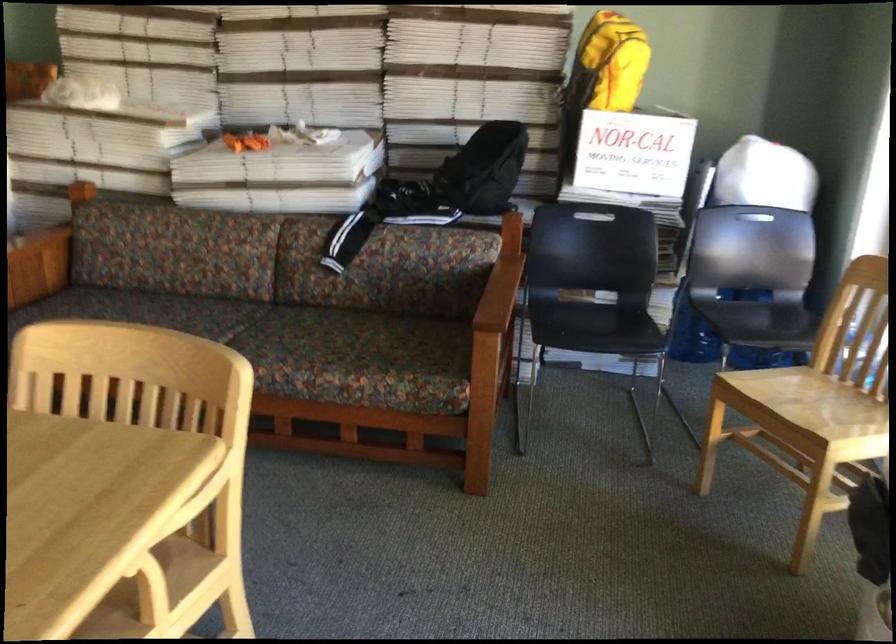
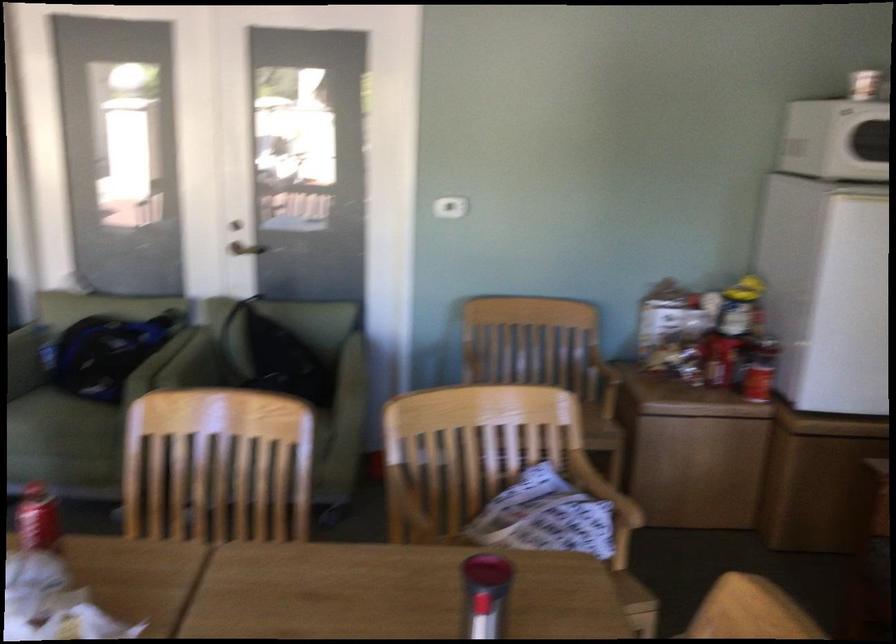
Question: How did the camera likely rotate?

Choices:
 (A) Left
 (B) Right
 (C) Up
 (D) Down

Answer: (A)